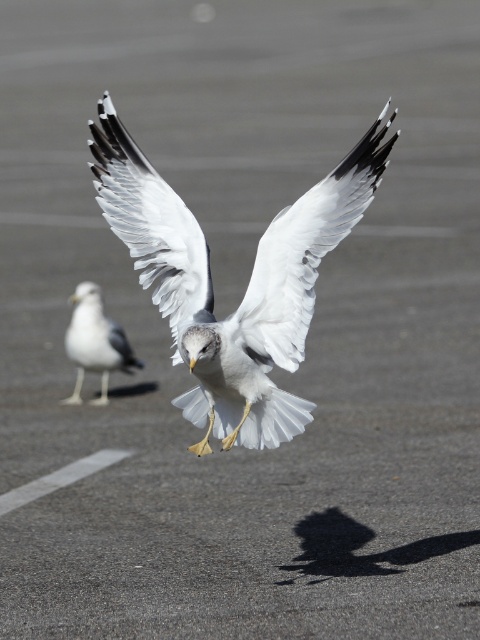
Question: Which object is positioned farthest from the white feathered bird at left?

Choices:
 (A) white matte wing at center
 (B) white feathered bird at center

Answer: (A)

Question: Which object is farther from the camera taking this photo?

Choices:
 (A) white feathered bird at center
 (B) white feathered bird at left
 (C) white matte wing at center

Answer: (B)

Question: Considering the relative positions of white feathered bird at center and white feathered bird at left in the image provided, where is white feathered bird at center located with respect to white feathered bird at left?

Choices:
 (A) above
 (B) below

Answer: (A)

Question: Which is nearer to the white matte wing at center?

Choices:
 (A) white feathered bird at center
 (B) white feathered bird at left

Answer: (A)

Question: Is white matte wing at center to the left of white feathered bird at left from the viewer's perspective?

Choices:
 (A) no
 (B) yes

Answer: (A)

Question: Can you confirm if white feathered bird at center is bigger than white feathered bird at left?

Choices:
 (A) yes
 (B) no

Answer: (A)